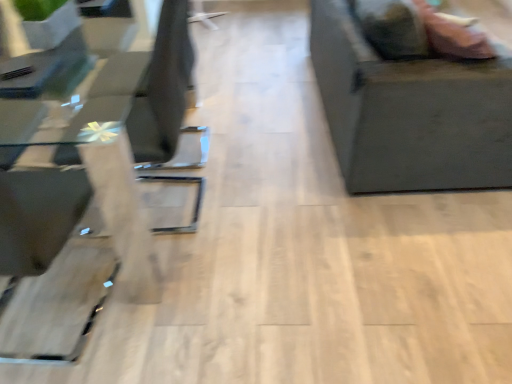
Image resolution: width=512 pixels, height=384 pixels. Find the location of `vacant area that lies in front of matte black couch at right`. vacant area that lies in front of matte black couch at right is located at coordinates (340, 266).